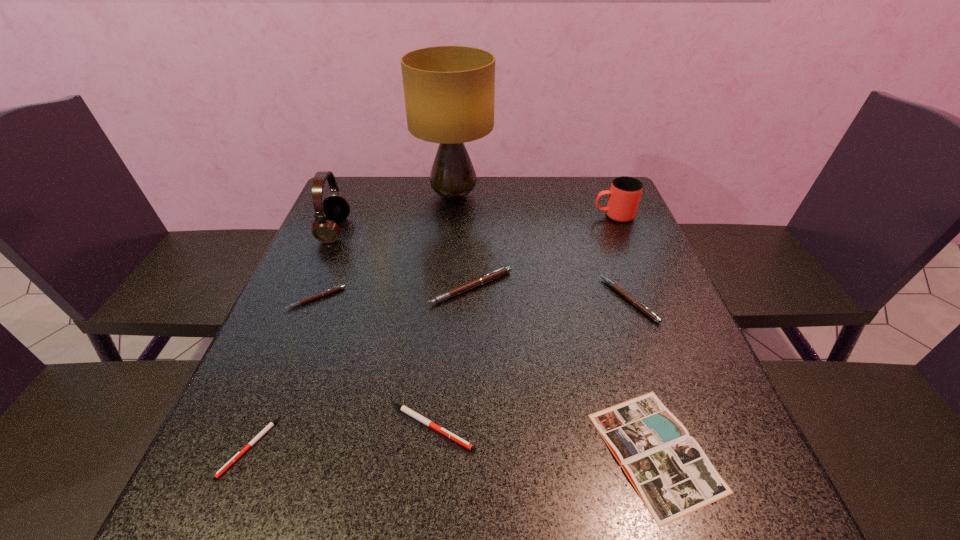
Identify the location of pink pen that is the third closest to the third tallest object. (340, 287).

Select which pink pen appears as the second closest to the sixth shortest object. Please provide its 2D coordinates. Your answer should be formatted as a tuple, i.e. [(x, y)], where the tuple contains the x and y coordinates of a point satisfying the conditions above.

[(626, 295)]

The width and height of the screenshot is (960, 540). I want to click on vacant region that satisfies the following two spatial constraints: 1. at the nib of the book; 2. on the right side of the tallest pen, so click(x=468, y=451).

Locate an element on the screen. Image resolution: width=960 pixels, height=540 pixels. free space that satisfies the following two spatial constraints: 1. at the nib of the tallest pen; 2. on the clicker of the right white pen is located at coordinates (468, 427).